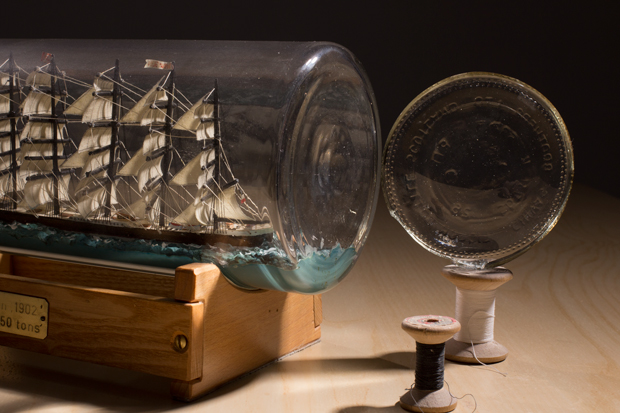
The image size is (620, 413). Identify the location of gold colored screw. (178, 346).